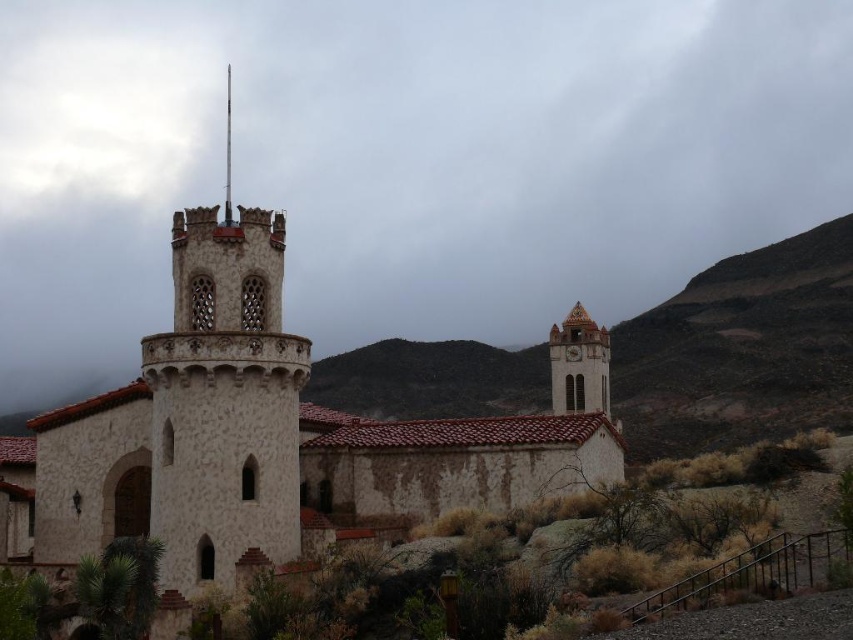
Question: Is white stone church at center wider than matte beige clock tower at center-right?

Choices:
 (A) no
 (B) yes

Answer: (B)

Question: Which point is farther from the camera taking this photo?

Choices:
 (A) (569, 346)
 (B) (619, 448)
 (C) (560, 371)

Answer: (A)

Question: Is matte beige clock tower at center-right further to camera compared to white stone clock at upper right?

Choices:
 (A) yes
 (B) no

Answer: (B)

Question: Which of the following is the farthest from the observer?

Choices:
 (A) smooth stone spire at upper center
 (B) white stone church at center
 (C) matte beige clock tower at center-right
 (D) white stone clock at upper right

Answer: (D)

Question: Considering the real-world distances, which object is closest to the matte beige clock tower at center-right?

Choices:
 (A) smooth stone spire at upper center
 (B) white stone church at center
 (C) white stone clock at upper right

Answer: (C)

Question: Can you confirm if white stone church at center is positioned below white stone clock at upper right?

Choices:
 (A) yes
 (B) no

Answer: (A)